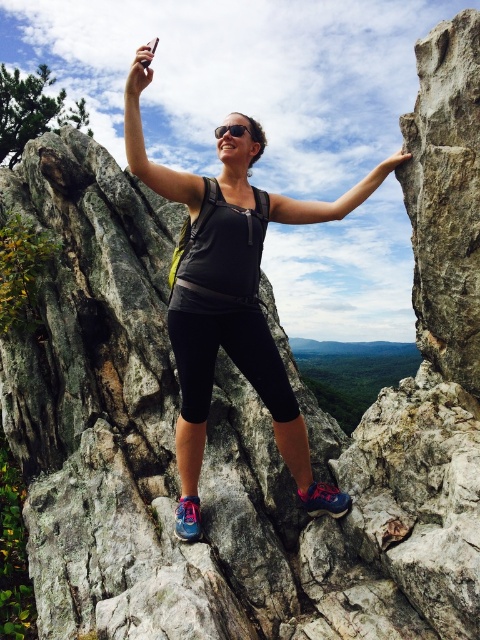
Question: Which of the following is the closest to the observer?

Choices:
 (A) (384, 164)
 (B) (320, 220)

Answer: (A)

Question: Estimate the real-world distances between objects in this image. Which object is closer to the matte black phone at upper center?

Choices:
 (A) black matte arm at upper center
 (B) matte black tank top at center
 (C) matte black arm at upper center

Answer: (B)

Question: Is matte black tank top at center to the right of matte black phone at upper center from the viewer's perspective?

Choices:
 (A) yes
 (B) no

Answer: (A)

Question: Is black matte arm at upper center in front of matte black phone at upper center?

Choices:
 (A) no
 (B) yes

Answer: (B)

Question: Is the position of black matte arm at upper center less distant than that of matte black phone at upper center?

Choices:
 (A) yes
 (B) no

Answer: (A)

Question: Which of these objects is positioned closest to the black matte arm at upper center?

Choices:
 (A) matte black arm at upper center
 (B) matte black phone at upper center
 (C) smooth stone hand at upper right

Answer: (C)